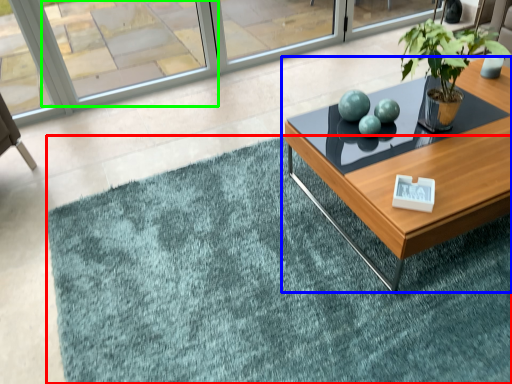
Question: Based on their relative distances, which object is farther from doormat (highlighted by a red box)? Choose from coffee table (highlighted by a blue box) and window (highlighted by a green box).

Choices:
 (A) coffee table
 (B) window

Answer: (B)